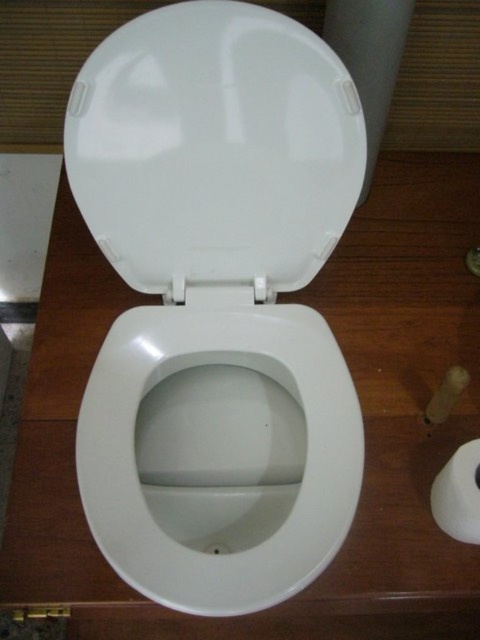
You are a bathroom designer assessing the space between the white glossy toilet bowl at center and the white glossy toilet lid at center. Which one has a greater height?

The white glossy toilet bowl at center is taller than the white glossy toilet lid at center.

You are a bathroom designer planning to install a new toilet. You need to place a decorative plant pot exactly at the point marked by coordinates point (219, 452). Based on the scene description, what object will the plant pot be placed on?

The point (219, 452) indicates the white glossy toilet bowl at center, so placing the decorative plant pot there would put it directly on the toilet bowl.